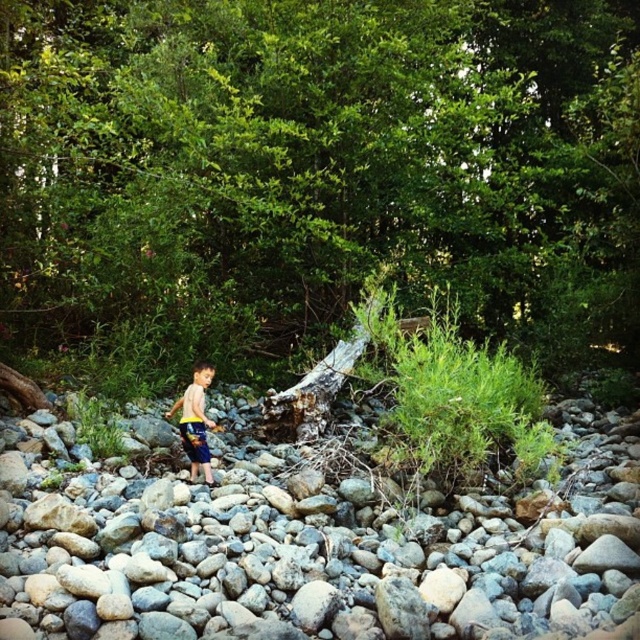
Who is taller, smooth gray rocks at center or yellow-blue shorts at center?

yellow-blue shorts at center

Is point (625, 426) positioned after point (193, 371)?

No, (625, 426) is closer to viewer.

What do you see at coordinates (316, 540) in the screenshot?
I see `smooth gray rocks at center` at bounding box center [316, 540].

Where is `smooth gray rocks at center`? Image resolution: width=640 pixels, height=640 pixels. smooth gray rocks at center is located at coordinates (316, 540).